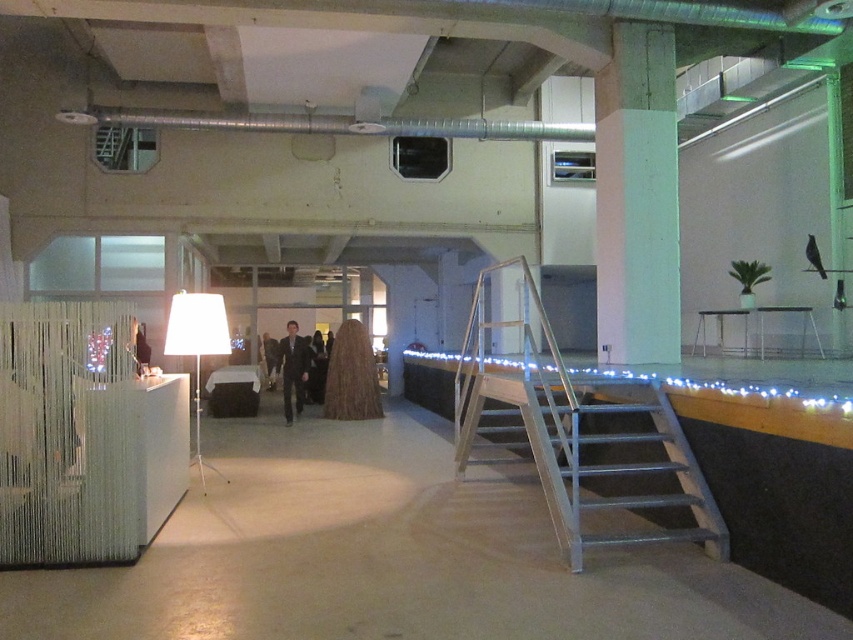
Question: Which object appears farthest from the camera in this image?

Choices:
 (A) dark gray suit at center
 (B) dark suit at center

Answer: (B)

Question: Does green concrete pillar at upper right have a smaller size compared to white fabric lamp at center?

Choices:
 (A) yes
 (B) no

Answer: (A)

Question: Which object is the closest to the dark suit at center?

Choices:
 (A) matte black suit at center
 (B) dark gray suit at center
 (C) green concrete pillar at upper right
 (D) metallic gray stairs at center

Answer: (B)

Question: Does white fabric lamp at center appear on the left side of dark gray suit at center?

Choices:
 (A) yes
 (B) no

Answer: (A)

Question: Which object is farther from the camera taking this photo?

Choices:
 (A) green concrete pillar at upper right
 (B) white fabric lamp at center

Answer: (A)

Question: Is metallic gray stairs at center positioned behind dark gray suit at center?

Choices:
 (A) no
 (B) yes

Answer: (A)